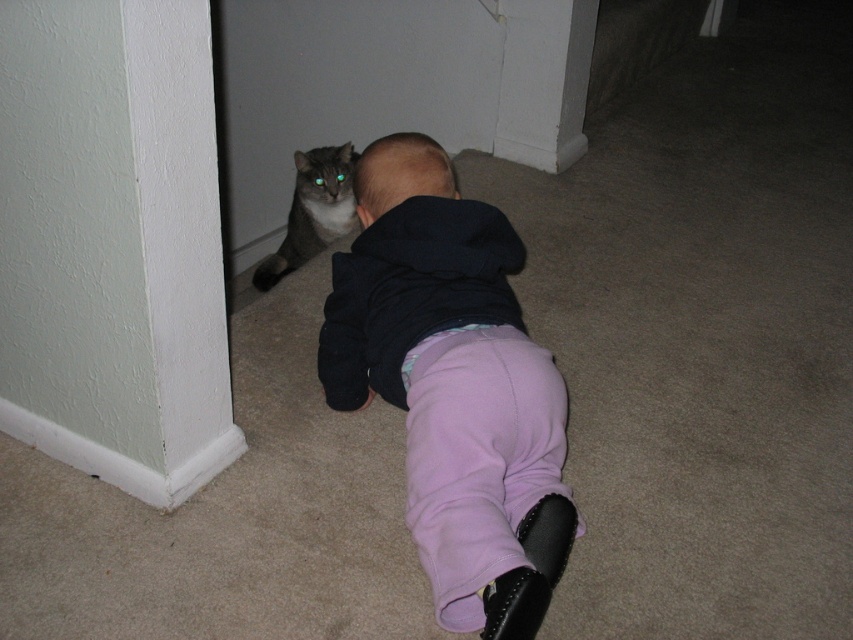
Who is positioned more to the left, purple fleece pants at center or gray fur cat at left?

From the viewer's perspective, gray fur cat at left appears more on the left side.

This screenshot has height=640, width=853. What do you see at coordinates (453, 387) in the screenshot? I see `purple fleece pants at center` at bounding box center [453, 387].

What do you see at coordinates (453, 387) in the screenshot?
I see `purple fleece pants at center` at bounding box center [453, 387].

Where is `purple fleece pants at center`? This screenshot has height=640, width=853. purple fleece pants at center is located at coordinates (453, 387).

Is point (572, 509) positioned behind point (450, 163)?

No, (572, 509) is closer to viewer.

Does point (434, 272) lie behind point (389, 138)?

No.

The height and width of the screenshot is (640, 853). I want to click on purple fleece pants at center, so click(453, 387).

Locate an element on the screen. gray fur cat at left is located at coordinates (312, 211).

How far apart are gray fur cat at left and smooth black hair at center?

gray fur cat at left and smooth black hair at center are 30.51 inches apart.

Image resolution: width=853 pixels, height=640 pixels. Describe the element at coordinates (312, 211) in the screenshot. I see `gray fur cat at left` at that location.

Locate an element on the screen. The width and height of the screenshot is (853, 640). gray fur cat at left is located at coordinates pyautogui.click(x=312, y=211).